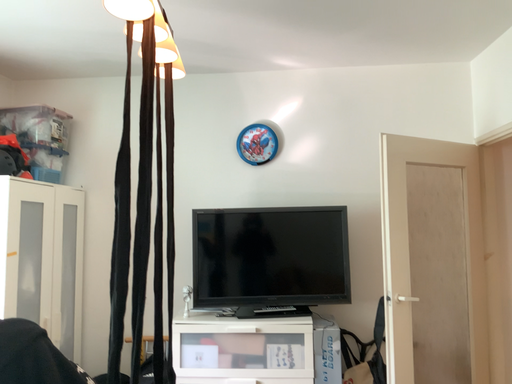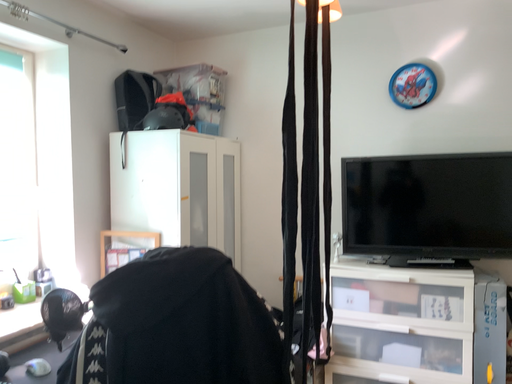
Question: How did the camera likely rotate when shooting the video?

Choices:
 (A) rotated upward
 (B) rotated downward

Answer: (B)